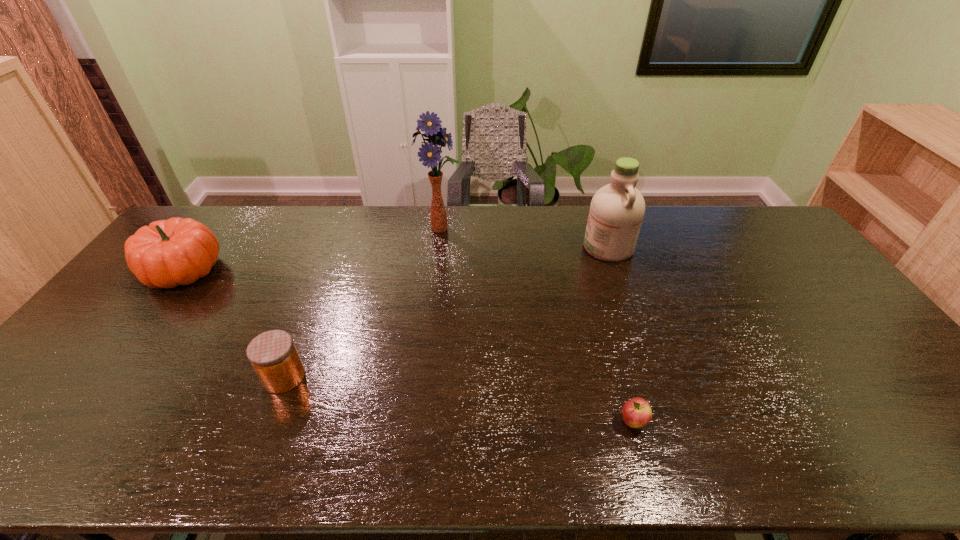
Where is `free space between the third tallest object and the fourth shortest object`? The width and height of the screenshot is (960, 540). free space between the third tallest object and the fourth shortest object is located at coordinates (396, 259).

Locate an element on the screen. free spot between the cleansing agent and the leftmost object is located at coordinates (396, 259).

I want to click on vacant area between the cleansing agent and the second nearest object, so click(446, 312).

You are a GUI agent. You are given a task and a screenshot of the screen. Output one action in this format:
    pyautogui.click(x=<x>, y=<y>)
    Task: Click on the blank region between the third object from left to right and the cleansing agent
    The width and height of the screenshot is (960, 540).
    Given the screenshot: What is the action you would take?
    pyautogui.click(x=524, y=238)

You are a GUI agent. You are given a task and a screenshot of the screen. Output one action in this format:
    pyautogui.click(x=<x>, y=<y>)
    Task: Click on the vacant space in between the tallest object and the second shortest object
    The height and width of the screenshot is (540, 960).
    Given the screenshot: What is the action you would take?
    pyautogui.click(x=363, y=303)

Image resolution: width=960 pixels, height=540 pixels. Find the location of `object that is the nearest to the pumpkin`. object that is the nearest to the pumpkin is located at coordinates (273, 355).

The width and height of the screenshot is (960, 540). In order to click on the third closest object to the nearest object in this screenshot , I will do `click(273, 355)`.

The width and height of the screenshot is (960, 540). In order to click on vacant area in the image that satisfies the following two spatial constraints: 1. on the front label of the second tallest object; 2. on the front side of the fourth farthest object in this screenshot , I will do `click(654, 377)`.

The height and width of the screenshot is (540, 960). In order to click on vacant region that satisfies the following two spatial constraints: 1. on the front label of the second tallest object; 2. on the front side of the fourth object from right to left in this screenshot , I will do `click(654, 377)`.

At what (x,y) coordinates should I click in order to perform the action: click on free space that satisfies the following two spatial constraints: 1. on the front label of the second tallest object; 2. on the front side of the fourth farthest object. Please return your answer as a coordinate pair (x, y). Looking at the image, I should click on (654, 377).